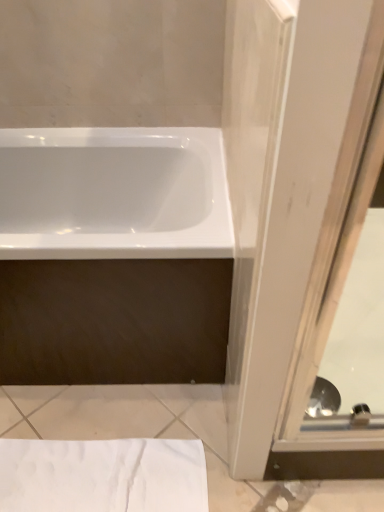
Question: Is white textured towel at lower left taller or shorter than clear glass screen door at right?

Choices:
 (A) tall
 (B) short

Answer: (B)

Question: In terms of size, does white textured towel at lower left appear bigger or smaller than clear glass screen door at right?

Choices:
 (A) big
 (B) small

Answer: (B)

Question: Based on their relative distances, which object is nearer to the white textured towel at lower left?

Choices:
 (A) white glossy bathtub at center
 (B) clear glass screen door at right

Answer: (B)

Question: Estimate the real-world distances between objects in this image. Which object is closer to the white textured towel at lower left?

Choices:
 (A) clear glass screen door at right
 (B) white glossy bathtub at center

Answer: (A)